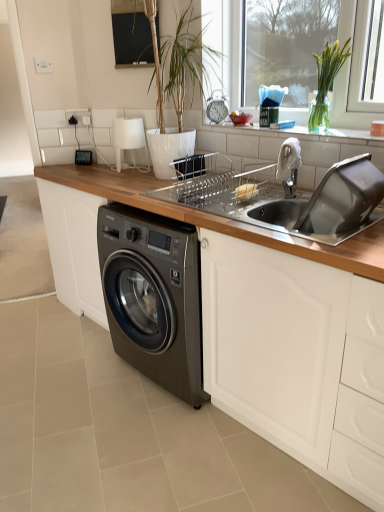
Question: Is silver metallic faucet at upper right oriented towards metallic silver clock at center?

Choices:
 (A) no
 (B) yes

Answer: (A)

Question: Are silver metallic faucet at upper right and metallic silver clock at center located far from each other?

Choices:
 (A) no
 (B) yes

Answer: (A)

Question: Can you confirm if silver metallic faucet at upper right is wider than metallic silver clock at center?

Choices:
 (A) no
 (B) yes

Answer: (B)

Question: From a real-world perspective, is silver metallic faucet at upper right over metallic silver clock at center?

Choices:
 (A) no
 (B) yes

Answer: (A)

Question: Is silver metallic faucet at upper right bigger than metallic silver clock at center?

Choices:
 (A) no
 (B) yes

Answer: (B)

Question: Based on their positions, is metallic silver clock at center located to the left or right of wooden at lower left?

Choices:
 (A) left
 (B) right

Answer: (B)

Question: Is point (223, 104) positioned closer to the camera than point (67, 287)?

Choices:
 (A) farther
 (B) closer

Answer: (B)

Question: From the image's perspective, relative to wooden at lower left, is metallic silver clock at center above or below?

Choices:
 (A) below
 (B) above

Answer: (B)

Question: Is metallic silver clock at center situated inside wooden at lower left or outside?

Choices:
 (A) outside
 (B) inside

Answer: (A)

Question: From their relative heights in the image, would you say stainless steel sink at upper right is taller or shorter than white glossy window sill at upper center?

Choices:
 (A) tall
 (B) short

Answer: (A)

Question: Considering the positions of stainless steel sink at upper right and white glossy window sill at upper center in the image, is stainless steel sink at upper right wider or thinner than white glossy window sill at upper center?

Choices:
 (A) thin
 (B) wide

Answer: (B)

Question: From a real-world perspective, is stainless steel sink at upper right physically located above or below white glossy window sill at upper center?

Choices:
 (A) above
 (B) below

Answer: (B)

Question: Is point (322, 230) positioned closer to the camera than point (316, 133)?

Choices:
 (A) closer
 (B) farther

Answer: (A)

Question: Which is correct: silver metallic faucet at upper right is inside white glossy window sill at upper center, or outside of it?

Choices:
 (A) inside
 (B) outside

Answer: (B)

Question: Considering the positions of silver metallic faucet at upper right and white glossy window sill at upper center in the image, is silver metallic faucet at upper right wider or thinner than white glossy window sill at upper center?

Choices:
 (A) wide
 (B) thin

Answer: (B)